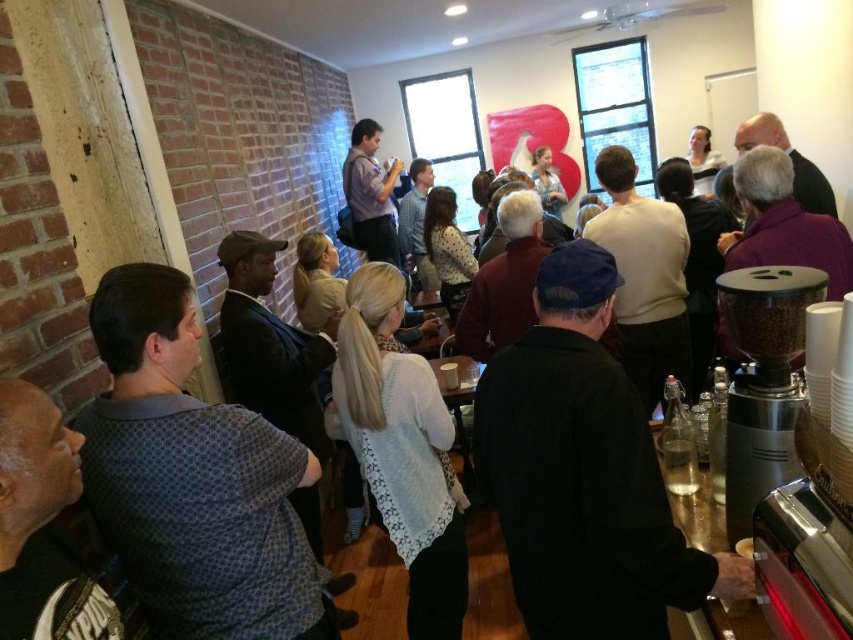
You are at a social event and want to grab a coffee. You see the metallic gray coffee grinder at right and the smooth white cup at lower right. Which object is positioned to the right side?

The metallic gray coffee grinder at right is positioned to the right of the smooth white cup at lower right.